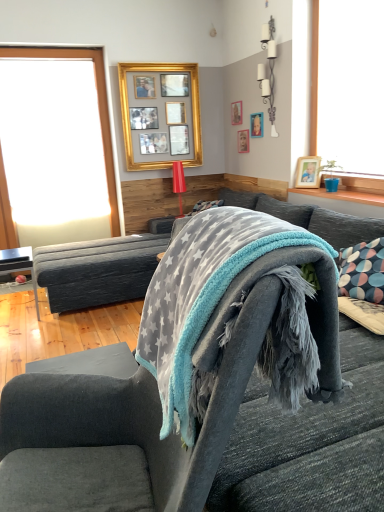
Question: From the image's perspective, is brushed metal table at lower left below wooden picture frame at upper center, the fourth picture frame when ordered from left to right?

Choices:
 (A) no
 (B) yes

Answer: (B)

Question: From a real-world perspective, is brushed metal table at lower left on wooden picture frame at upper center, the fourth picture frame when ordered from left to right?

Choices:
 (A) no
 (B) yes

Answer: (A)

Question: Can you confirm if brushed metal table at lower left is shorter than wooden picture frame at upper center, the fourth picture frame when ordered from left to right?

Choices:
 (A) yes
 (B) no

Answer: (B)

Question: Is brushed metal table at lower left oriented towards wooden picture frame at upper center, which is the 2th picture frame in right-to-left order?

Choices:
 (A) no
 (B) yes

Answer: (A)

Question: Can you confirm if brushed metal table at lower left is smaller than wooden picture frame at upper center, the fourth picture frame when ordered from left to right?

Choices:
 (A) yes
 (B) no

Answer: (B)

Question: Is brushed metal table at lower left to the left of wooden picture frame at upper center, which is the 2th picture frame in right-to-left order, from the viewer's perspective?

Choices:
 (A) no
 (B) yes

Answer: (B)

Question: Does gold metallic picture frame at upper center, the fifth picture frame positioned from the right, come in front of velvet grey armchair at center?

Choices:
 (A) yes
 (B) no

Answer: (B)

Question: From a real-world perspective, is gold metallic picture frame at upper center, which is the first picture frame from left to right, over velvet grey armchair at center?

Choices:
 (A) no
 (B) yes

Answer: (B)

Question: Is gold metallic picture frame at upper center, the fifth picture frame positioned from the right, wider than velvet grey armchair at center?

Choices:
 (A) yes
 (B) no

Answer: (B)

Question: From the image's perspective, is gold metallic picture frame at upper center, the fifth picture frame positioned from the right, located above velvet grey armchair at center?

Choices:
 (A) yes
 (B) no

Answer: (A)

Question: Does gold metallic picture frame at upper center, which is the first picture frame from left to right, have a lesser height compared to velvet grey armchair at center?

Choices:
 (A) yes
 (B) no

Answer: (A)

Question: Is gold metallic picture frame at upper center, the fifth picture frame positioned from the right, not near velvet grey armchair at center?

Choices:
 (A) yes
 (B) no

Answer: (A)

Question: Is wooden picture frame at upper center, acting as the second picture frame starting from the left, placed right next to gold metallic picture frame at upper center, which is the first picture frame from left to right?

Choices:
 (A) no
 (B) yes

Answer: (A)